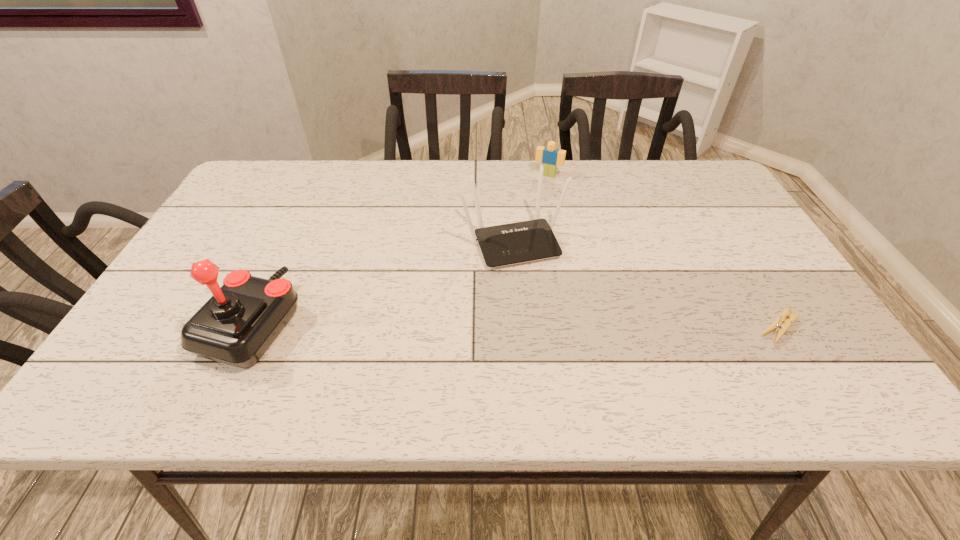
Where is `blank area in the image that satisfies the following two spatial constraints: 1. on the back side of the third shortest object; 2. on the left side of the farthest object`? This screenshot has height=540, width=960. blank area in the image that satisfies the following two spatial constraints: 1. on the back side of the third shortest object; 2. on the left side of the farthest object is located at coordinates (508, 175).

Where is `vacant area that satisfies the following two spatial constraints: 1. on the front side of the second tallest object; 2. on the right side of the clothespin`? This screenshot has width=960, height=540. vacant area that satisfies the following two spatial constraints: 1. on the front side of the second tallest object; 2. on the right side of the clothespin is located at coordinates 520,327.